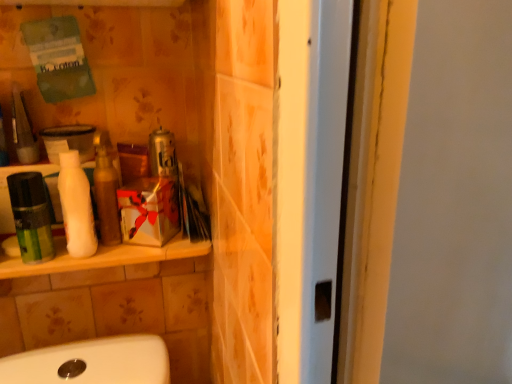
I want to click on white matte bottle at left, so click(x=76, y=206).

What is the approximate width of white matte bottle at left?

2.24 inches.

Locate an element on the screen. metallic can at center is located at coordinates (162, 154).

The width and height of the screenshot is (512, 384). Find the location of `white matte bottle at left`. white matte bottle at left is located at coordinates (76, 206).

Is white matte lotion at left turned away from white matte bottle at left?

No, white matte lotion at left is not facing the opposite direction of white matte bottle at left.

Considering the positions of objects white matte lotion at left and white matte bottle at left in the image provided, who is behind, white matte lotion at left or white matte bottle at left?

white matte lotion at left is further from the camera.

From a real-world perspective, is white matte lotion at left positioned under white matte bottle at left based on gravity?

No, from a real-world perspective, white matte lotion at left is not below white matte bottle at left.

Considering the relative positions of white matte lotion at left and white matte bottle at left in the image provided, is white matte lotion at left to the left or to the right of white matte bottle at left?

white matte lotion at left is to the right of white matte bottle at left.

Does point (103, 204) come in front of point (34, 225)?

No, it is behind (34, 225).

Is white matte lotion at left far away from green matte mouthwash at left?

white matte lotion at left is actually quite close to green matte mouthwash at left.

Is white matte lotion at left not within green matte mouthwash at left?

Yes, white matte lotion at left is not within green matte mouthwash at left.

From the image's perspective, is white matte lotion at left located above or below green matte mouthwash at left?

Based on their image positions, white matte lotion at left is located above green matte mouthwash at left.

Looking at the image, does metallic can at center seem bigger or smaller compared to white matte bottle at left?

In the image, metallic can at center appears to be smaller than white matte bottle at left.

Is metallic can at center to the left of white matte bottle at left from the viewer's perspective?

No, metallic can at center is not to the left of white matte bottle at left.

Would you say metallic can at center is a long distance from white matte bottle at left?

No, metallic can at center is in close proximity to white matte bottle at left.

In the image, is white matte bottle at left on the left side or the right side of metallic can at center?

From the image, it's evident that white matte bottle at left is to the left of metallic can at center.

Who is shorter, white matte bottle at left or metallic can at center?

metallic can at center is shorter.

Between white matte bottle at left and metallic can at center, which one has larger size?

white matte bottle at left is bigger.

Is white matte bottle at left positioned before metallic can at center?

Yes, the depth of white matte bottle at left is less than that of metallic can at center.

Does white matte bottle at left have a lesser height compared to green matte mouthwash at left?

No, white matte bottle at left is not shorter than green matte mouthwash at left.

Which of these two, white matte bottle at left or green matte mouthwash at left, is thinner?

green matte mouthwash at left is thinner.

Is white matte bottle at left next to green matte mouthwash at left?

Yes, white matte bottle at left and green matte mouthwash at left clearly make contact.

Which is correct: white matte bottle at left is inside green matte mouthwash at left, or outside of it?

white matte bottle at left is outside green matte mouthwash at left.

Is metallic can at center not within green matte mouthwash at left?

Yes, metallic can at center is outside of green matte mouthwash at left.

At what (x,y) coordinates should I click in order to perform the action: click on mouthwash on the left of metallic can at center. Please return your answer as a coordinate pair (x, y). The width and height of the screenshot is (512, 384). Looking at the image, I should click on (31, 217).

From the image's perspective, relative to green matte mouthwash at left, is metallic can at center above or below?

From the image's perspective, metallic can at center appears above green matte mouthwash at left.

Which is closer to the camera, (164, 166) or (10, 180)?

The point (10, 180) is in front.

Considering the positions of objects white matte lotion at left and metallic can at center in the image provided, who is more to the right, white matte lotion at left or metallic can at center?

metallic can at center.

Who is taller, white matte lotion at left or metallic can at center?

white matte lotion at left is taller.

Considering the relative sizes of white matte lotion at left and metallic can at center in the image provided, is white matte lotion at left bigger than metallic can at center?

No.

Looking at their sizes, would you say white matte lotion at left is wider or thinner than metallic can at center?

Clearly, white matte lotion at left has less width compared to metallic can at center.

Identify the location of toiletry on the right of white matte bottle at left. Image resolution: width=512 pixels, height=384 pixels. (106, 197).

Find the location of a particular element. The height and width of the screenshot is (384, 512). toiletry that is above the green matte mouthwash at left (from a real-world perspective) is located at coordinates (106, 197).

Considering their positions, is metallic can at center positioned further to white matte bottle at left than white matte lotion at left?

metallic can at center lies further to white matte bottle at left than the other object.

From the image, which object appears to be nearer to white matte lotion at left, green matte mouthwash at left or metallic can at center?

Based on the image, metallic can at center appears to be nearer to white matte lotion at left.

Which object lies nearer to the anchor point green matte mouthwash at left, metallic can at center or white matte bottle at left?

white matte bottle at left is positioned closer to the anchor green matte mouthwash at left.

Based on their spatial positions, is green matte mouthwash at left or white matte bottle at left closer to white matte lotion at left?

white matte bottle at left.

From the image, which object appears to be farther from white matte lotion at left, white matte bottle at left or green matte mouthwash at left?

green matte mouthwash at left.

From the image, which object appears to be nearer to white matte lotion at left, white matte bottle at left or metallic can at center?

white matte bottle at left is closer to white matte lotion at left.

When comparing their distances from metallic can at center, does white matte lotion at left or white matte bottle at left seem further?

Based on the image, white matte bottle at left appears to be further to metallic can at center.

Considering their positions, is white matte lotion at left positioned closer to green matte mouthwash at left than white matte bottle at left?

Among the two, white matte bottle at left is located nearer to green matte mouthwash at left.

Where is `cleaning product between green matte mouthwash at left and white matte lotion at left`? Image resolution: width=512 pixels, height=384 pixels. cleaning product between green matte mouthwash at left and white matte lotion at left is located at coordinates pos(76,206).

You are a GUI agent. You are given a task and a screenshot of the screen. Output one action in this format:
    pyautogui.click(x=<x>, y=<y>)
    Task: Click on the toiletry between green matte mouthwash at left and metallic can at center in the horizontal direction
    
    Given the screenshot: What is the action you would take?
    pyautogui.click(x=106, y=197)

This screenshot has height=384, width=512. I want to click on cleaning product between green matte mouthwash at left and metallic can at center from left to right, so click(76, 206).

Find the location of `toiletry located between white matte bottle at left and metallic can at center in the left-right direction`. toiletry located between white matte bottle at left and metallic can at center in the left-right direction is located at coordinates (106, 197).